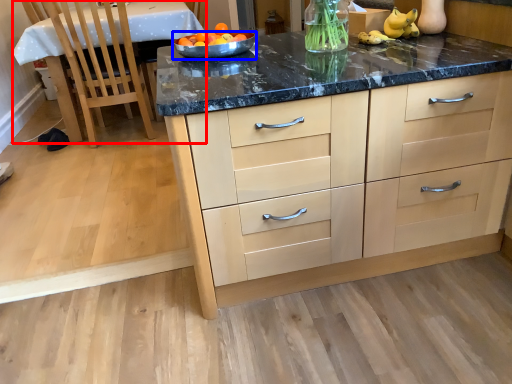
Question: Among these objects, which one is nearest to the camera, table (highlighted by a red box) or bowl (highlighted by a blue box)?

Choices:
 (A) table
 (B) bowl

Answer: (B)